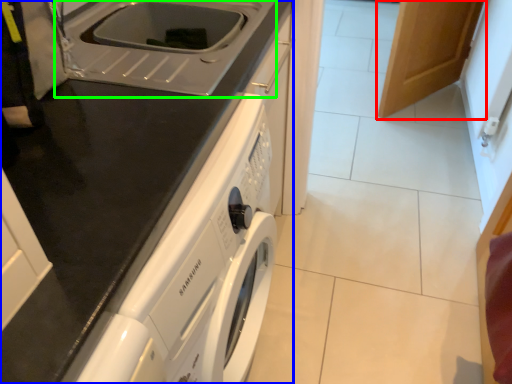
Question: Which is farther away from cabinetry (highlighted by a red box)? home appliance (highlighted by a blue box) or sink (highlighted by a green box)?

Choices:
 (A) home appliance
 (B) sink

Answer: (A)